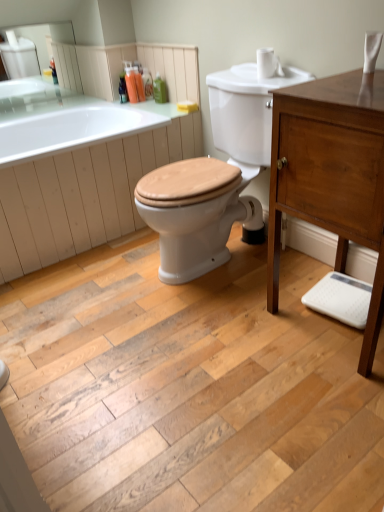
You are a GUI agent. You are given a task and a screenshot of the screen. Output one action in this format:
    pyautogui.click(x=<x>, y=<y>)
    Task: Click on the vacant space in between white glossy toilet at center and matte brown cabinet at right
    This screenshot has height=512, width=384.
    Given the screenshot: What is the action you would take?
    pyautogui.click(x=269, y=308)